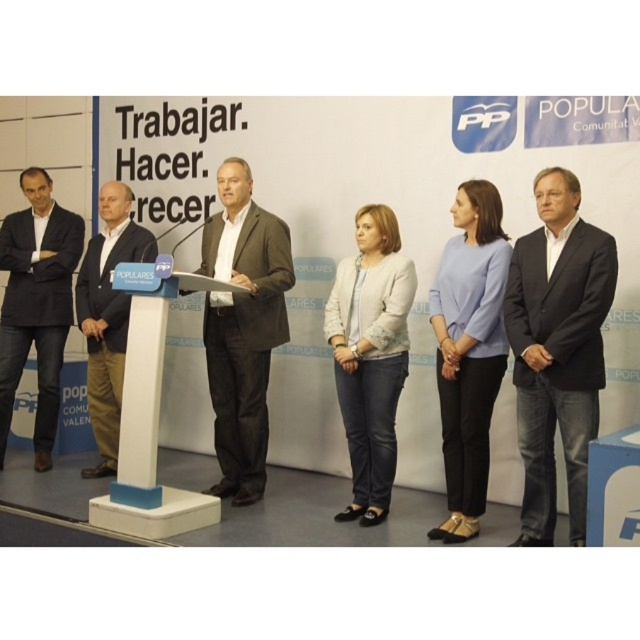
Between dark gray suit at right and dark gray suit at center, which one appears on the left side from the viewer's perspective?

dark gray suit at center is more to the left.

Between point (576, 442) and point (221, 435), which one is positioned in front?

Positioned in front is point (576, 442).

Locate an element on the screen. This screenshot has height=640, width=640. dark gray suit at right is located at coordinates (557, 349).

Looking at this image, which of these two, light gray textured blazer at center or white plastic podium at center, stands taller?

light gray textured blazer at center

Can you confirm if light gray textured blazer at center is thinner than white plastic podium at center?

Yes, light gray textured blazer at center is thinner than white plastic podium at center.

Does point (355, 333) come in front of point (157, 280)?

No.

Identify the location of light gray textured blazer at center. The width and height of the screenshot is (640, 640). (371, 355).

Measure the distance between dark gray suit at right and camera.

9.68 feet

Does dark gray suit at right appear over light gray textured blazer at center?

Indeed, dark gray suit at right is positioned over light gray textured blazer at center.

Which is behind, point (544, 273) or point (396, 232)?

The point (396, 232) is more distant.

You are a GUI agent. You are given a task and a screenshot of the screen. Output one action in this format:
    pyautogui.click(x=<x>, y=<y>)
    Task: Click on the dark gray suit at right
    Image resolution: width=640 pixels, height=640 pixels.
    Given the screenshot: What is the action you would take?
    pyautogui.click(x=557, y=349)